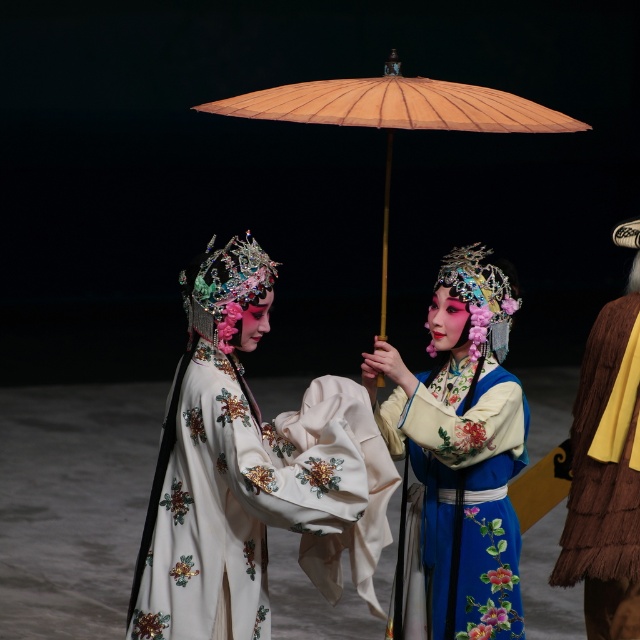
You are an audience member sitting in the front row of the opera. You notice two items at the center of the stage. One is the white satin dress at center and the other is the matte beige parasol at center. Which one is positioned to the left side of the other?

The white satin dress at center is to the left of the matte beige parasol at center.

You are an audience member sitting in the front row of the opera. You notice the white satin dress at center and the matte beige parasol at center. Which object appears narrower when viewed from your seat?

The white satin dress at center appears narrower than the matte beige parasol at center because the description states that the white satin dress has a lesser width compared to the matte beige parasol.

You are a stagehand in a traditional Chinese opera performance. You need to place a prop on the white satin dress at center. The stage coordinates are given as a grid from 0 to 1 in both x and y directions. What are the coordinates where you should place the prop?

The coordinates for the white satin dress at center are at point (227, 468), so you should place the prop there.